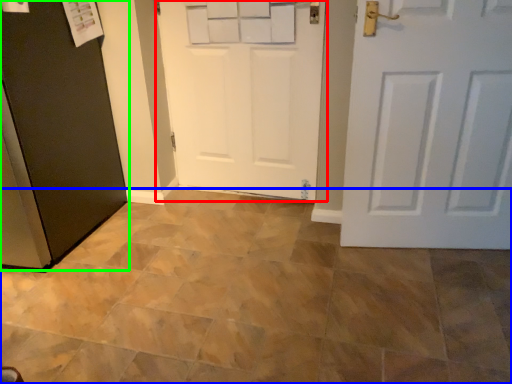
Question: Considering the real-world distances, which object is closest to door (highlighted by a red box)? ceramic tile (highlighted by a blue box) or door (highlighted by a green box).

Choices:
 (A) ceramic tile
 (B) door

Answer: (B)